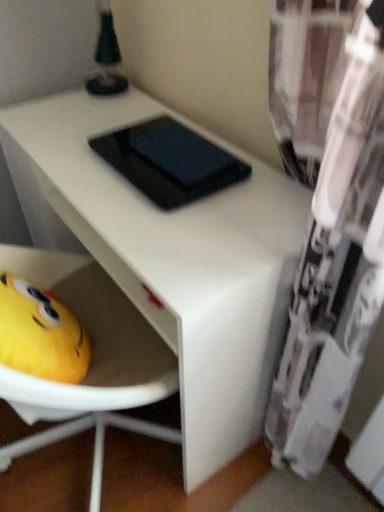
Where is `free space in front of black matte pad at center`? free space in front of black matte pad at center is located at coordinates (182, 229).